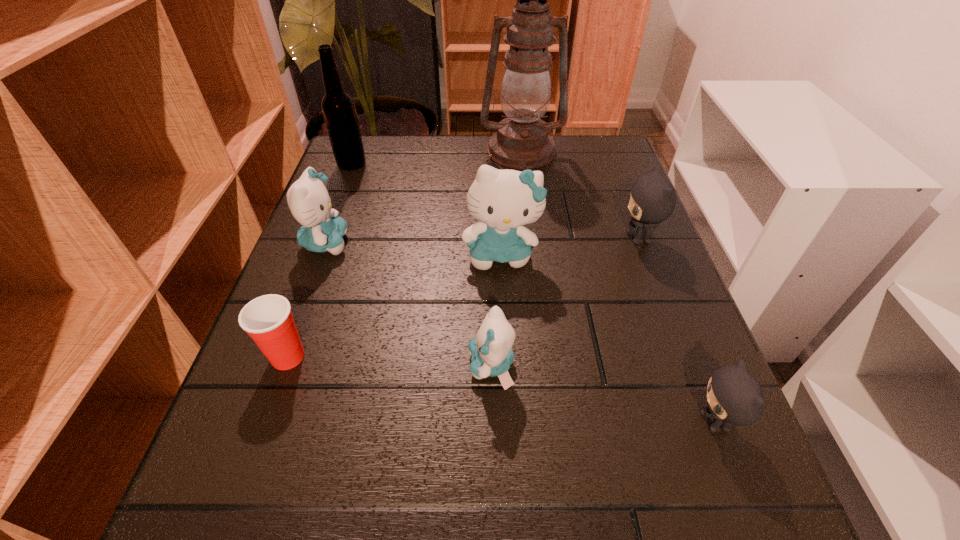
Locate an element on the screen. vacant space situated on the right of the red Dixie cup is located at coordinates (423, 357).

The width and height of the screenshot is (960, 540). Find the location of `free space located on the front-facing side of the smaller gray kitten`. free space located on the front-facing side of the smaller gray kitten is located at coordinates (539, 422).

Locate an element on the screen. The height and width of the screenshot is (540, 960). vacant area situated 0.120m on the front-facing side of the smaller gray kitten is located at coordinates (609, 422).

You are a GUI agent. You are given a task and a screenshot of the screen. Output one action in this format:
    pyautogui.click(x=<x>, y=<y>)
    Task: Click on the free region located 0.100m on the front-facing side of the smaller gray kitten
    
    Given the screenshot: What is the action you would take?
    pyautogui.click(x=622, y=422)

At what (x,y) coordinates should I click in order to perform the action: click on oil lamp present at the far edge. Please return your answer as a coordinate pair (x, y). Looking at the image, I should click on (522, 142).

Find the location of a particular element. beer bottle located at the far edge is located at coordinates (338, 107).

Locate an element on the screen. The height and width of the screenshot is (540, 960). beer bottle at the left edge is located at coordinates (338, 107).

You are a GUI agent. You are given a task and a screenshot of the screen. Output one action in this format:
    pyautogui.click(x=<x>, y=<y>)
    Task: Click on the kitten situated at the left edge
    
    Given the screenshot: What is the action you would take?
    pyautogui.click(x=309, y=201)

This screenshot has width=960, height=540. I want to click on Dixie cup that is at the left edge, so click(x=268, y=320).

The image size is (960, 540). Identify the location of oil lamp that is at the right edge. (522, 142).